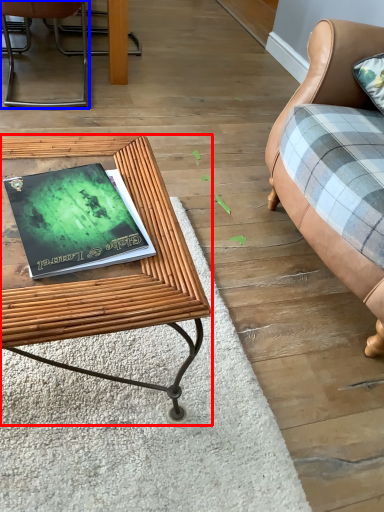
Question: Which point is closer to the camera, table (highlighted by a red box) or chair (highlighted by a blue box)?

Choices:
 (A) table
 (B) chair

Answer: (A)